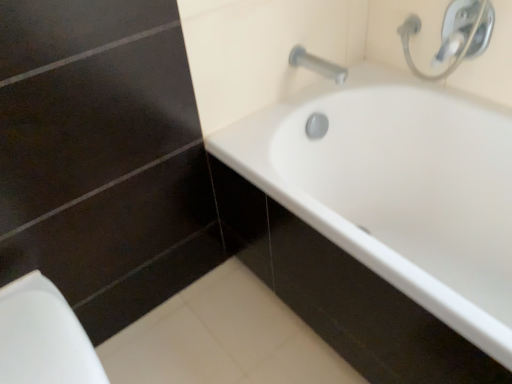
Where is `empty space that is ontop of white glossy porcelain at lower left`? empty space that is ontop of white glossy porcelain at lower left is located at coordinates (30, 329).